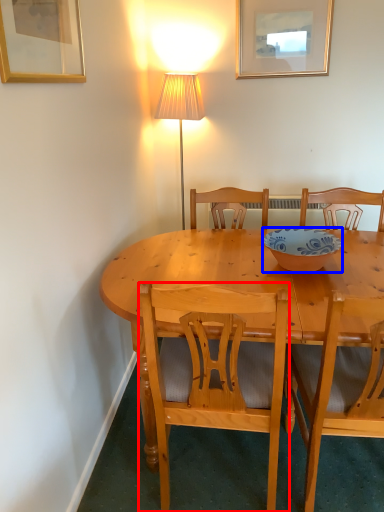
Question: Which of the following is the closest to the observer, chair (highlighted by a red box) or bowl (highlighted by a blue box)?

Choices:
 (A) chair
 (B) bowl

Answer: (A)